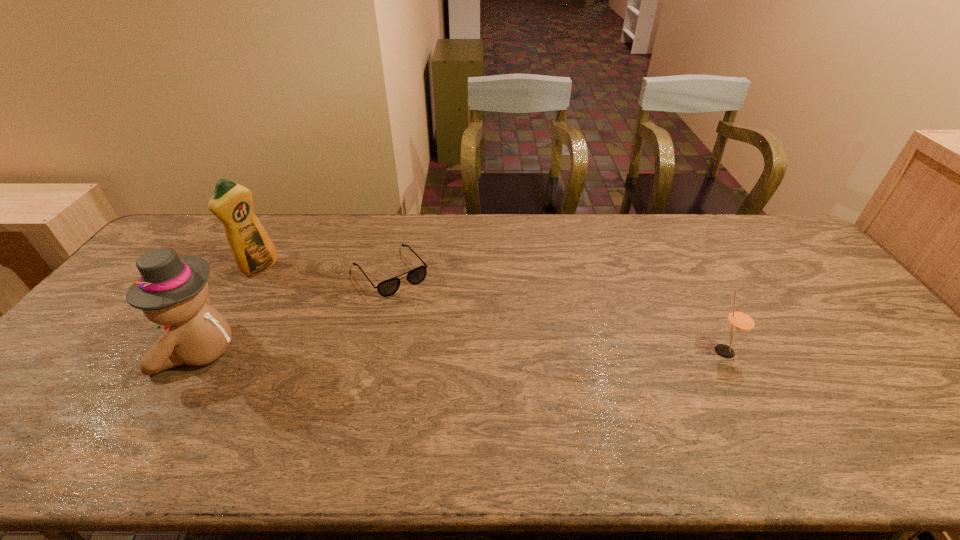
I want to click on vacant space at the right edge of the desktop, so click(806, 298).

I want to click on vacant space at the near left corner of the desktop, so click(37, 400).

What are the coordinates of `free space at the far right corner` in the screenshot? It's located at (768, 230).

The width and height of the screenshot is (960, 540). Identify the location of unoccupied position between the straw and the detergent. (492, 309).

Find the location of a particular element. Image resolution: width=960 pixels, height=540 pixels. vacant region between the rag_doll and the third object from left to right is located at coordinates (296, 312).

Identify the location of free spot between the shortest object and the detergent. (325, 269).

Find the location of `empty space between the rightmost object and the detergent`. empty space between the rightmost object and the detergent is located at coordinates (492, 309).

Find the location of `unoccupied area between the spectacles and the rightmost object`. unoccupied area between the spectacles and the rightmost object is located at coordinates (558, 312).

Find the location of a particular element. The height and width of the screenshot is (540, 960). empty location between the rag_doll and the second shortest object is located at coordinates (463, 351).

Where is `free spot between the detergent and the third object from left to right`? The image size is (960, 540). free spot between the detergent and the third object from left to right is located at coordinates (325, 269).